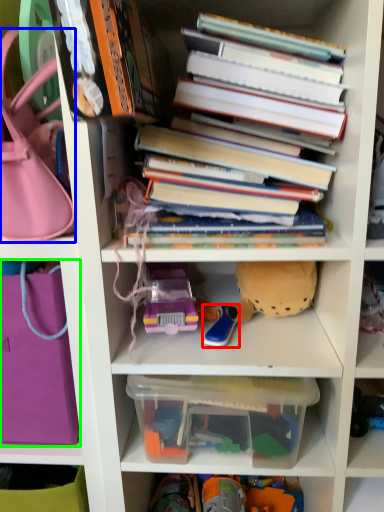
Question: Which object is the farthest from toy (highlighted by a red box)? Choose among these: handbag (highlighted by a blue box) or handbag (highlighted by a green box).

Choices:
 (A) handbag
 (B) handbag

Answer: (A)